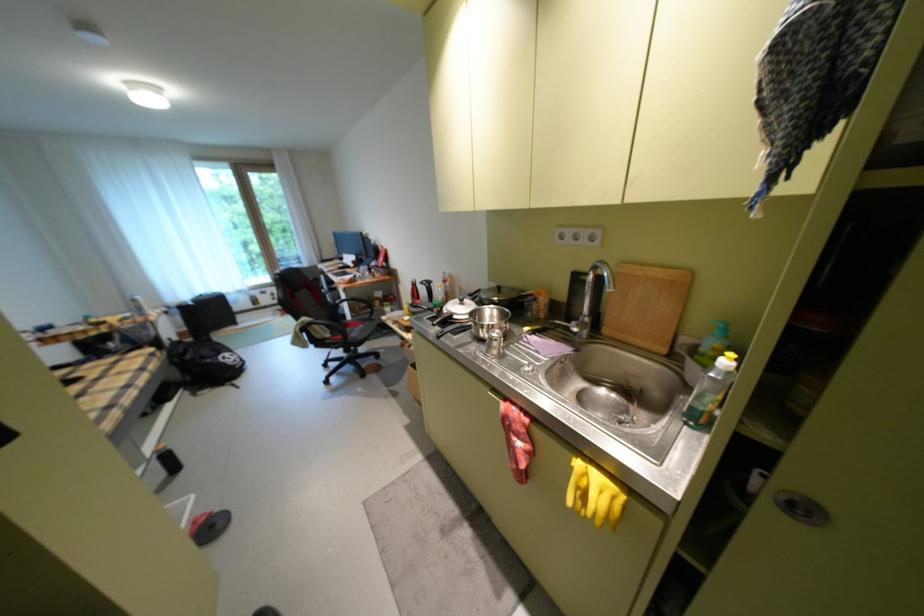
Describe the element at coordinates (807, 511) in the screenshot. The height and width of the screenshot is (616, 924). I see `the recessed door handle` at that location.